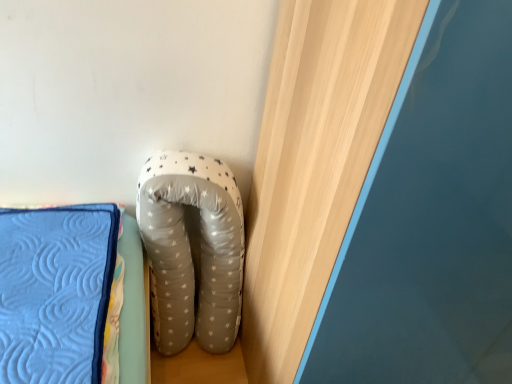
Describe the element at coordinates (190, 249) in the screenshot. I see `white dotted fabric pillow at center` at that location.

Measure the distance between white dotted fabric pillow at center and camera.

white dotted fabric pillow at center and camera are 3.63 feet apart from each other.

Locate an element on the screen. The image size is (512, 384). white dotted fabric pillow at center is located at coordinates (190, 249).

In order to face wooden at upper right, should I rotate leftwards or rightwards?

Rotate your view right by about 13.306°.

The height and width of the screenshot is (384, 512). Describe the element at coordinates (314, 162) in the screenshot. I see `wooden at upper right` at that location.

Find the location of a particular element. wooden at upper right is located at coordinates (314, 162).

Identify the location of white dotted fabric pillow at center. The width and height of the screenshot is (512, 384). (190, 249).

Which is more to the left, white dotted fabric pillow at center or wooden at upper right?

From the viewer's perspective, white dotted fabric pillow at center appears more on the left side.

Does white dotted fabric pillow at center lie in front of wooden at upper right?

That is False.

Is point (225, 333) farther from camera compared to point (272, 338)?

Yes, it is.

Based on the photo, from the image's perspective, between white dotted fabric pillow at center and wooden at upper right, who is located below?

white dotted fabric pillow at center appears lower in the image.

Based on the photo, from a real-world perspective, is white dotted fabric pillow at center physically above wooden at upper right?

No.

Considering the relative sizes of white dotted fabric pillow at center and wooden at upper right in the image provided, is white dotted fabric pillow at center thinner than wooden at upper right?

Yes.

Who is shorter, white dotted fabric pillow at center or wooden at upper right?

white dotted fabric pillow at center.

Does white dotted fabric pillow at center have a larger size compared to wooden at upper right?

No, white dotted fabric pillow at center is not bigger than wooden at upper right.

Is white dotted fabric pillow at center outside of wooden at upper right?

white dotted fabric pillow at center lies outside wooden at upper right's area.

Is white dotted fabric pillow at center not near wooden at upper right?

They are positioned close to each other.

Is white dotted fabric pillow at center facing towards wooden at upper right?

No, white dotted fabric pillow at center is not turned towards wooden at upper right.

This screenshot has width=512, height=384. Find the location of `footwear behind the wooden at upper right`. footwear behind the wooden at upper right is located at coordinates (190, 249).

Would you say wooden at upper right is to the left or to the right of white dotted fabric pillow at center in the picture?

From the image, it's evident that wooden at upper right is to the right of white dotted fabric pillow at center.

Relative to white dotted fabric pillow at center, is wooden at upper right in front or behind?

Clearly, wooden at upper right is in front of white dotted fabric pillow at center.

Is point (375, 9) positioned behind point (212, 189)?

No.

From the image's perspective, which object appears higher, wooden at upper right or white dotted fabric pillow at center?

wooden at upper right, from the image's perspective.

From a real-world perspective, relative to white dotted fabric pillow at center, is wooden at upper right vertically above or below?

wooden at upper right is situated higher than white dotted fabric pillow at center in the real world.

Which object is thinner, wooden at upper right or white dotted fabric pillow at center?

Thinner between the two is white dotted fabric pillow at center.

Who is shorter, wooden at upper right or white dotted fabric pillow at center?

With less height is white dotted fabric pillow at center.

Based on their sizes in the image, would you say wooden at upper right is bigger or smaller than white dotted fabric pillow at center?

wooden at upper right is bigger than white dotted fabric pillow at center.

Is wooden at upper right inside the boundaries of white dotted fabric pillow at center, or outside?

wooden at upper right is not enclosed by white dotted fabric pillow at center.

Are wooden at upper right and white dotted fabric pillow at center located far from each other?

wooden at upper right is near white dotted fabric pillow at center, not far away.

Is white dotted fabric pillow at center at the back of wooden at upper right?

No, wooden at upper right's orientation is not away from white dotted fabric pillow at center.

This screenshot has height=384, width=512. I want to click on footwear behind the wooden at upper right, so click(190, 249).

I want to click on footwear directly beneath the wooden at upper right (from a real-world perspective), so click(190, 249).

You are a GUI agent. You are given a task and a screenshot of the screen. Output one action in this format:
    pyautogui.click(x=<x>, y=<y>)
    Task: Click on the curtain that is above the white dotted fabric pillow at center (from the image's perspective)
    This screenshot has height=384, width=512.
    Given the screenshot: What is the action you would take?
    pyautogui.click(x=314, y=162)